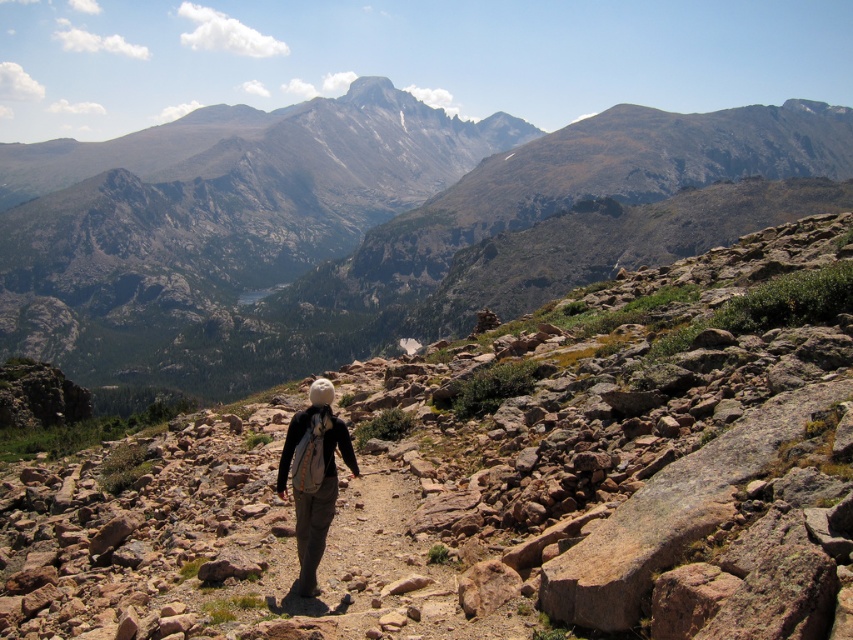
You are a hiker planning to ascend the rugged granite mountain at center while carrying your light brown fabric backpack at center. Based on their positions in the image, which object is higher up in the scene?

The rugged granite mountain at center is located above the light brown fabric backpack at center, so the rugged granite mountain at center is higher up in the scene.

You are a hiker planning to climb the rugged granite mountain at center. Your backpack, the light brown fabric backpack at center, has a capacity of 50 liters. If you need to carry enough water for a 6 hour hike, and each liter of water weighs 1 kg, how many liters of water should you carry?

The rugged granite mountain at center is 294.18 meters from light brown fabric backpack at center. To determine the required water, first calculate the time needed to climb the mountain. However, the distance alone isn not sufficient without knowing the hiker s pace. Thus, the given information isn t enough to calculate the water requirement.

Consider the image. You are a hiker planning to reach a specific point marked at coordinates point (585, 202). Given that you can walk at a pace of 3 feet per second, how many seconds will it take you to reach the point from your current position?

The distance of point (585, 202) from camera is 691.57 feet. At a pace of 3 feet per second, it will take 691.57 divided by 3, which is approximately 230.5 seconds to reach the point.